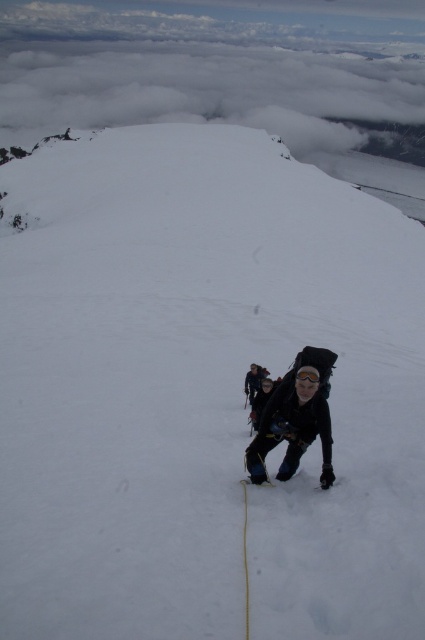
You are a climber planning to secure your gear. You have a white nylon rope at center and a matte black backpack at center. Which item should you attach to your harness if you need something that is lower in height?

You should attach the white nylon rope at center to your harness because it has a lesser height compared to the matte black backpack at center.

You are a mountain guide assessing the equipment of your team. You notice the black matte jacket at center and the white nylon rope at center. Which piece of equipment is larger in size?

The black matte jacket at center is bigger than the white nylon rope at center.

You are a photographer planning to take a closeup shot of the black matte jacket at center and the matte black backpack at center. Which object should you focus on first if you want to capture both in sharp focus without adjusting the camera focus?

The black matte jacket at center is bigger than the matte black backpack at center. To capture both in sharp focus, you should focus on the black matte jacket at center first since it is larger and requires more precise focus alignment.